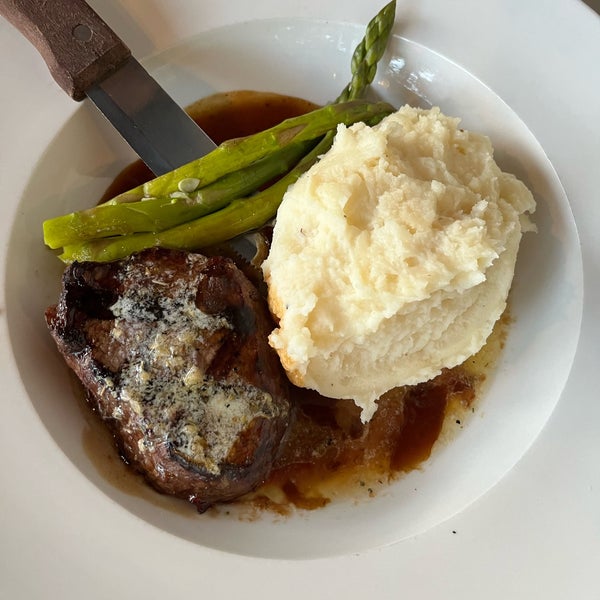
Find the location of a particular element. Image resolution: width=600 pixels, height=600 pixels. white plate is located at coordinates (391, 521).